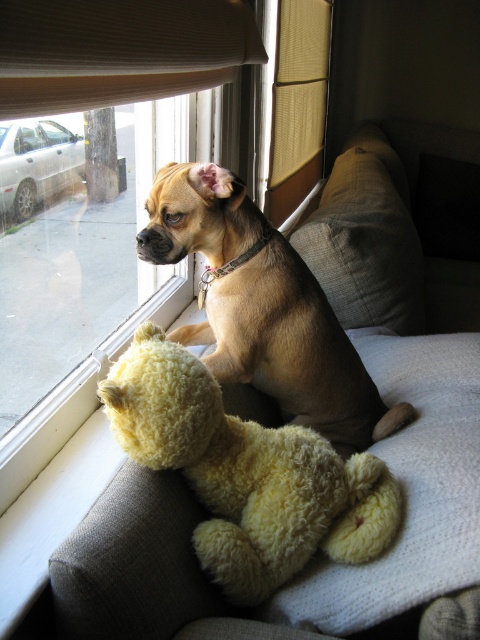
You are a dog owner who wants to ensure your dog stays cool on a hot day. The dog is sitting on a beige cushioned surface. Given the scene, where is the light brown fur at center in relation to the clear glass window at upper left?

The light brown fur at center is positioned under the clear glass window at upper left, so the dog is sitting directly below the window, which might help keep it cool due to airflow or shade from the window frame.

Looking at this image, you are a dog owner trying to decide if your dog can reach the window to look outside. Based on the scene, can the dog with light brown fur at center reach the clear glass window at upper left considering their size?

The light brown fur at center has a smaller size compared to clear glass window at upper left, so the dog may be able to reach the window depending on its proximity and the dog reaching up.

The dog is sitting on the light brown fur at center. There is a soft beige couch at center in front of it. If the dog wants to reach the teddy bear on the couch, which direction should it move?

The soft beige couch at center is in front of the light brown fur at center, so the dog should move forward to reach the teddy bear on the couch.